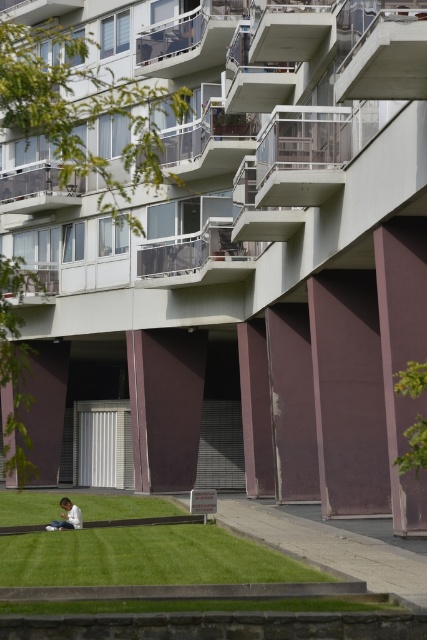
Question: Which object is positioned farthest from the glassy white balcony at upper left?

Choices:
 (A) green grass at lower center
 (B) white cotton shirt at lower center

Answer: (A)

Question: Is clear glass balcony at center bigger than white cotton shirt at lower center?

Choices:
 (A) no
 (B) yes

Answer: (A)

Question: Among these points, which one is nearest to the camera?

Choices:
 (A) (210, 257)
 (B) (66, 500)
 (C) (47, 179)

Answer: (B)

Question: Based on their relative distances, which object is farther from the green grass at lower center?

Choices:
 (A) glassy white balcony at upper left
 (B) clear glass balcony at center

Answer: (A)

Question: Can you confirm if green grass at lower center is positioned to the right of glassy white balcony at upper left?

Choices:
 (A) no
 (B) yes

Answer: (B)

Question: Can you confirm if green grass at lower center is positioned to the right of clear glass balcony at center?

Choices:
 (A) no
 (B) yes

Answer: (B)